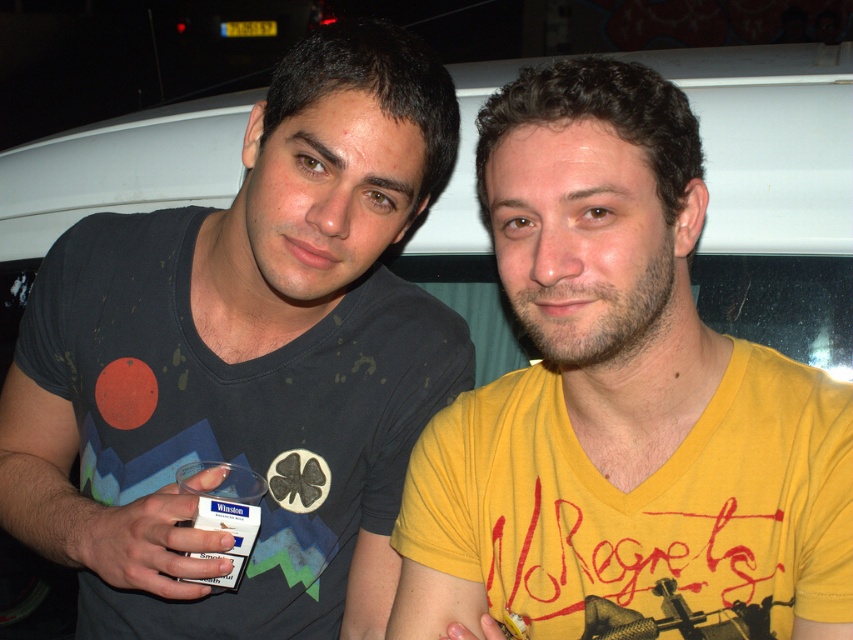
Question: Can you confirm if dark gray t-shirt at center is positioned above yellow matte shirt at right?

Choices:
 (A) no
 (B) yes

Answer: (A)

Question: Is dark gray t-shirt at center wider than yellow matte shirt at right?

Choices:
 (A) no
 (B) yes

Answer: (B)

Question: Can you confirm if dark gray t-shirt at center is positioned to the left of yellow matte shirt at right?

Choices:
 (A) yes
 (B) no

Answer: (A)

Question: Which object is farther from the camera taking this photo?

Choices:
 (A) dark gray t-shirt at center
 (B) yellow matte shirt at right

Answer: (A)

Question: Which point is farther to the camera?

Choices:
 (A) yellow matte shirt at right
 (B) dark gray t-shirt at center

Answer: (B)